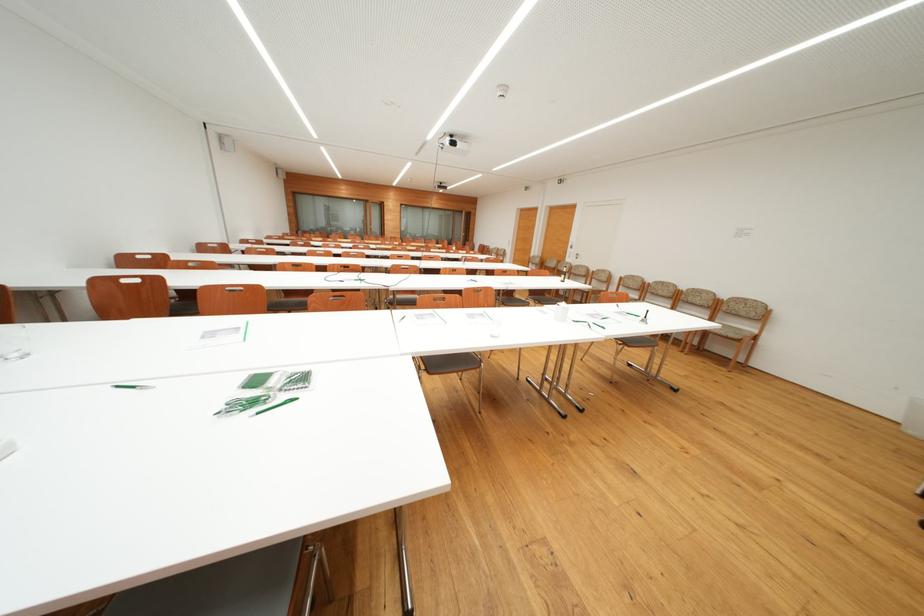
Where is `wall light switch`? wall light switch is located at coordinates (744, 231).